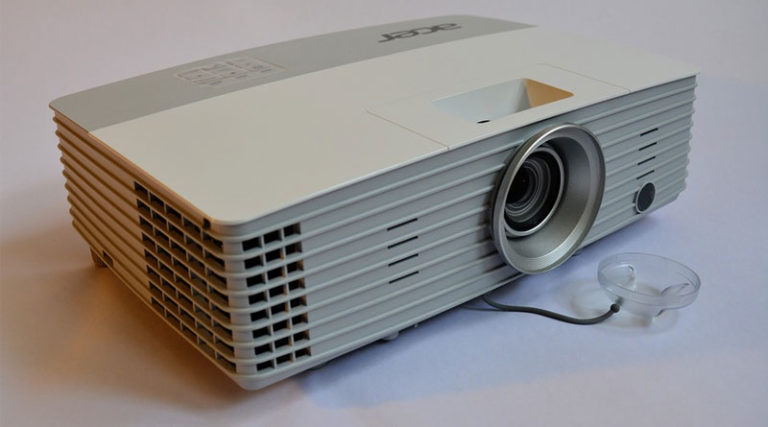
In order to click on projector in this screenshot , I will do `click(352, 162)`.